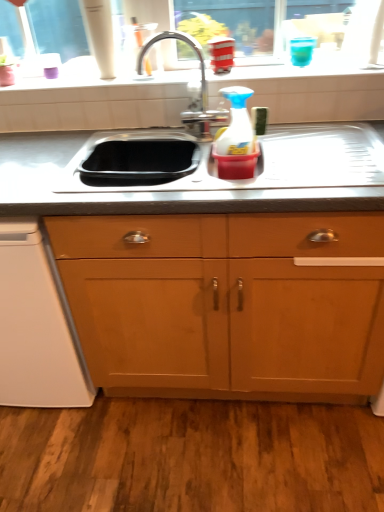
Question: From a real-world perspective, is stainless steel sink at center on white plastic dishwasher at lower left?

Choices:
 (A) yes
 (B) no

Answer: (A)

Question: Considering the relative sizes of stainless steel sink at center and white plastic dishwasher at lower left in the image provided, is stainless steel sink at center shorter than white plastic dishwasher at lower left?

Choices:
 (A) yes
 (B) no

Answer: (A)

Question: Can you confirm if stainless steel sink at center is smaller than white plastic dishwasher at lower left?

Choices:
 (A) yes
 (B) no

Answer: (A)

Question: From the image's perspective, is stainless steel sink at center on white plastic dishwasher at lower left?

Choices:
 (A) no
 (B) yes

Answer: (B)

Question: Is stainless steel sink at center further to the viewer compared to white plastic dishwasher at lower left?

Choices:
 (A) no
 (B) yes

Answer: (A)

Question: Would you say stainless steel sink at center is a long distance from white plastic dishwasher at lower left?

Choices:
 (A) yes
 (B) no

Answer: (B)

Question: Is wooden cabinet at center at the left side of white plastic dishwasher at lower left?

Choices:
 (A) yes
 (B) no

Answer: (B)

Question: From a real-world perspective, is wooden cabinet at center on white plastic dishwasher at lower left?

Choices:
 (A) yes
 (B) no

Answer: (A)

Question: Considering the relative sizes of wooden cabinet at center and white plastic dishwasher at lower left in the image provided, is wooden cabinet at center thinner than white plastic dishwasher at lower left?

Choices:
 (A) no
 (B) yes

Answer: (A)

Question: Is wooden cabinet at center to the right of white plastic dishwasher at lower left from the viewer's perspective?

Choices:
 (A) yes
 (B) no

Answer: (A)

Question: Can you confirm if wooden cabinet at center is smaller than white plastic dishwasher at lower left?

Choices:
 (A) no
 (B) yes

Answer: (A)

Question: Is wooden cabinet at center turned away from white plastic dishwasher at lower left?

Choices:
 (A) yes
 (B) no

Answer: (B)

Question: Does polished chrome faucet at center come in front of white glossy window sill at upper center?

Choices:
 (A) no
 (B) yes

Answer: (B)